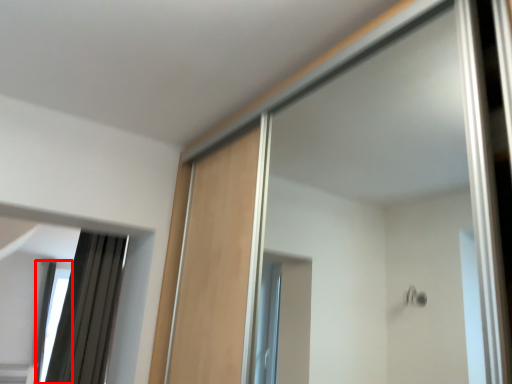
Question: Observing the image, what is the correct spatial positioning of window (annotated by the red box) in reference to mirror?

Choices:
 (A) right
 (B) left

Answer: (B)